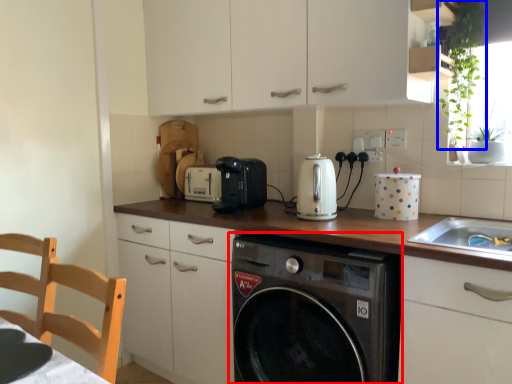
Question: Among these objects, which one is nearest to the camera, washing machine (highlighted by a red box) or plant (highlighted by a blue box)?

Choices:
 (A) washing machine
 (B) plant

Answer: (A)